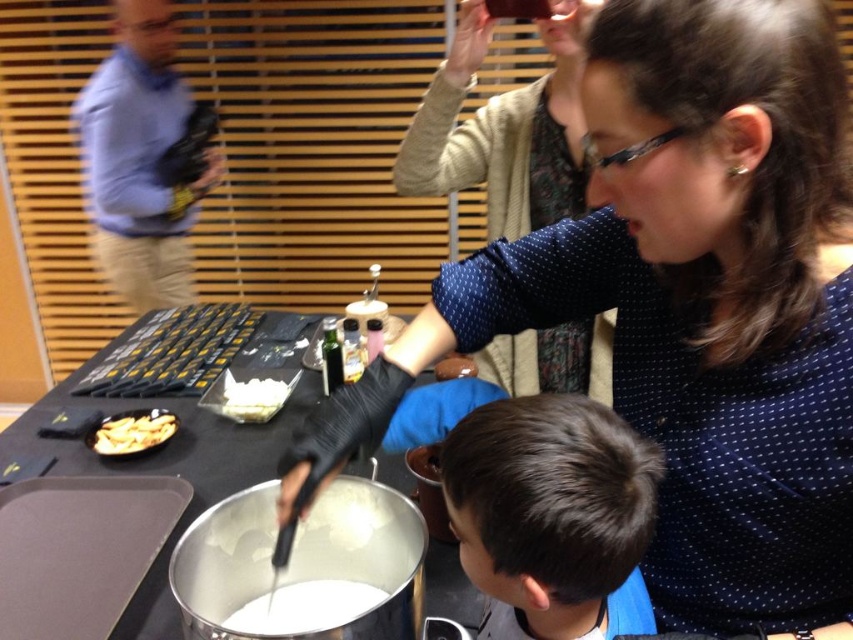
Question: Considering the real-world distances, which object is farthest from the matte black shirt at center?

Choices:
 (A) dark brown hair at lower center
 (B) white creamy substance at center
 (C) blue shirt at left

Answer: (C)

Question: Is matte black shirt at upper right to the right of yellow crispy chips at lower left from the viewer's perspective?

Choices:
 (A) yes
 (B) no

Answer: (A)

Question: Is matte black shirt at upper right positioned at the back of yellow crispy chips at lower left?

Choices:
 (A) yes
 (B) no

Answer: (B)

Question: Which object appears closest to the camera in this image?

Choices:
 (A) white creamy substance at center
 (B) yellow crispy chips at lower left
 (C) dark brown hair at lower center
 (D) matte black shirt at upper right

Answer: (C)

Question: Among these points, which one is nearest to the camera?

Choices:
 (A) (724, 257)
 (B) (173, 424)
 (C) (186, 301)
 (D) (436, 163)

Answer: (A)

Question: Where is dark brown hair at lower center located in relation to matte black shirt at upper right in the image?

Choices:
 (A) left
 (B) right

Answer: (A)